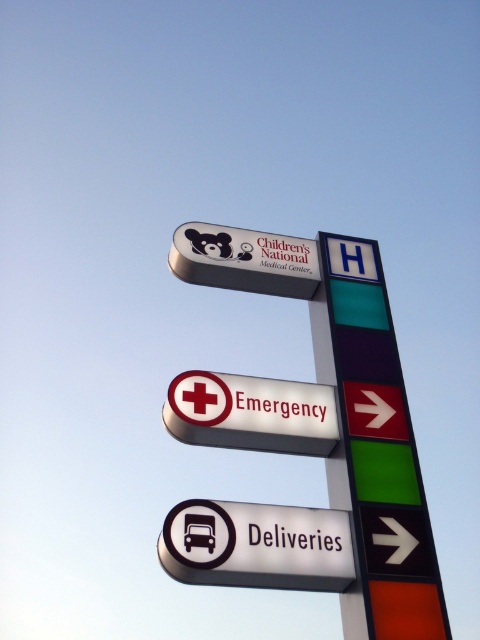
Between point (168, 404) and point (354, 525), which one is positioned in front?

Point (354, 525)

Is point (301, 435) positioned before point (331, 461)?

That is True.

Does point (197, 387) come closer to viewer compared to point (347, 502)?

That is False.

The image size is (480, 640). Find the location of `white plastic emergency sign at center`. white plastic emergency sign at center is located at coordinates (252, 413).

Is white plastic sign at lower center to the left of matte white sign at upper center from the viewer's perspective?

Yes, white plastic sign at lower center is to the left of matte white sign at upper center.

Who is lower down, white plastic sign at lower center or matte white sign at upper center?

white plastic sign at lower center is below.

Which is in front, point (188, 572) or point (215, 227)?

Positioned in front is point (188, 572).

Identify the location of white plastic sign at lower center. (256, 545).

Where is `white plastic emergency sign at center`? This screenshot has height=640, width=480. white plastic emergency sign at center is located at coordinates (252, 413).